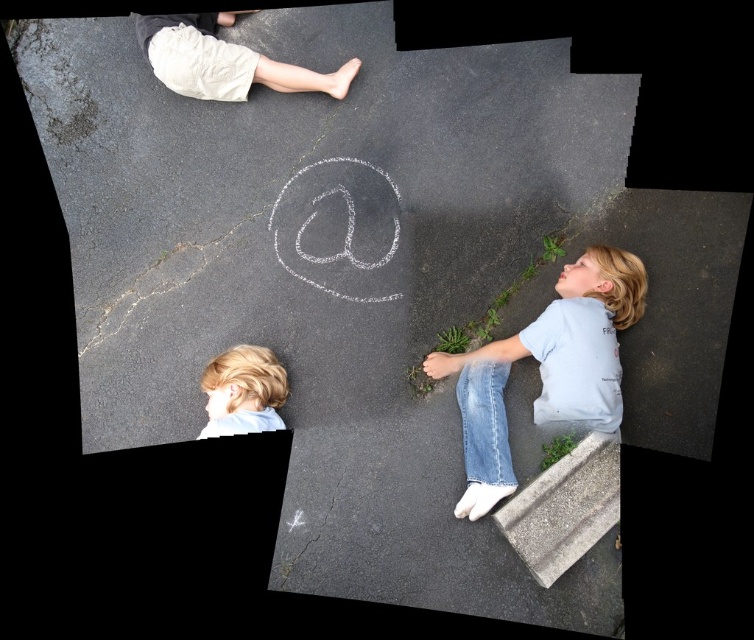
Looking at this image, can you confirm if light blue denim jeans at lower right is positioned to the left of blonde hair at lower left?

In fact, light blue denim jeans at lower right is to the right of blonde hair at lower left.

Does point (495, 428) lie in front of point (230, 394)?

No, it is not.

This screenshot has height=640, width=754. I want to click on light blue denim jeans at lower right, so click(546, 369).

Which of these two, gray concrete curb at lower right or light beige shorts at upper left, stands taller?

Standing taller between the two is gray concrete curb at lower right.

Is gray concrete curb at lower right behind light beige shorts at upper left?

That is False.

The width and height of the screenshot is (754, 640). What are the coordinates of `gray concrete curb at lower right` in the screenshot? It's located at (564, 508).

Is light blue denim jeans at lower right bigger than gray concrete curb at lower right?

Indeed, light blue denim jeans at lower right has a larger size compared to gray concrete curb at lower right.

Is point (541, 339) more distant than point (544, 586)?

Yes, point (541, 339) is farther from viewer.

The image size is (754, 640). Find the location of `light blue denim jeans at lower right`. light blue denim jeans at lower right is located at coordinates (546, 369).